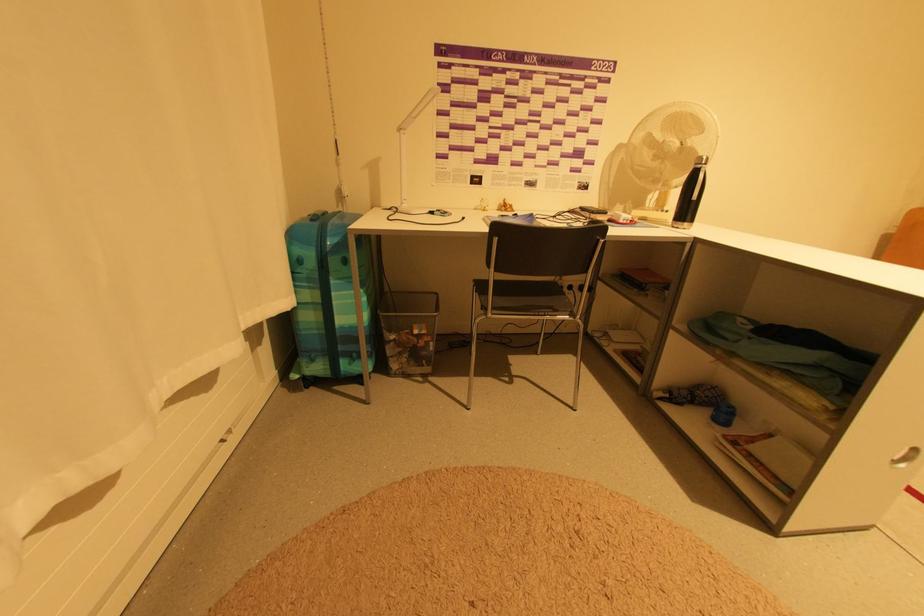
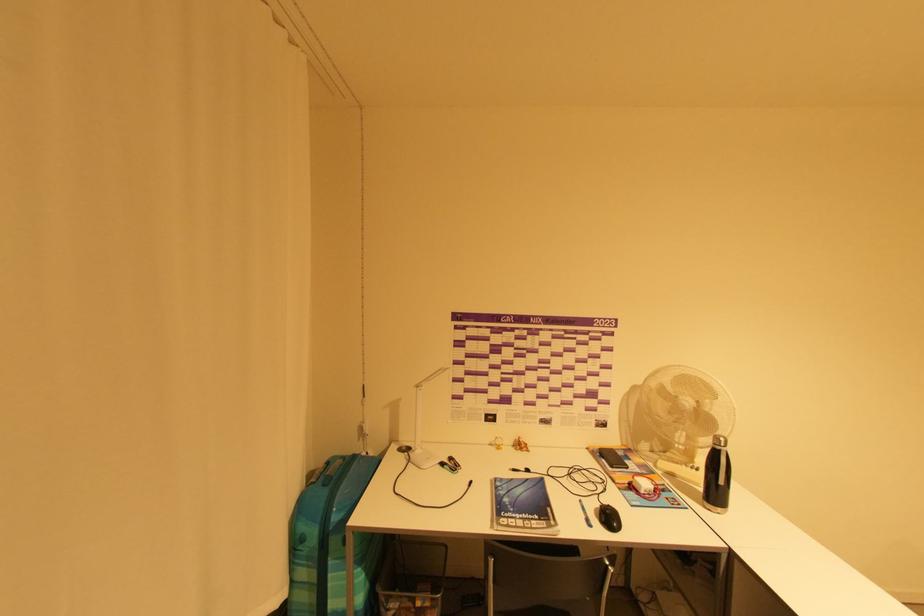
The images are taken continuously from a first-person perspective. In which direction are you moving?

The movement direction of the cameraman is right, backward.